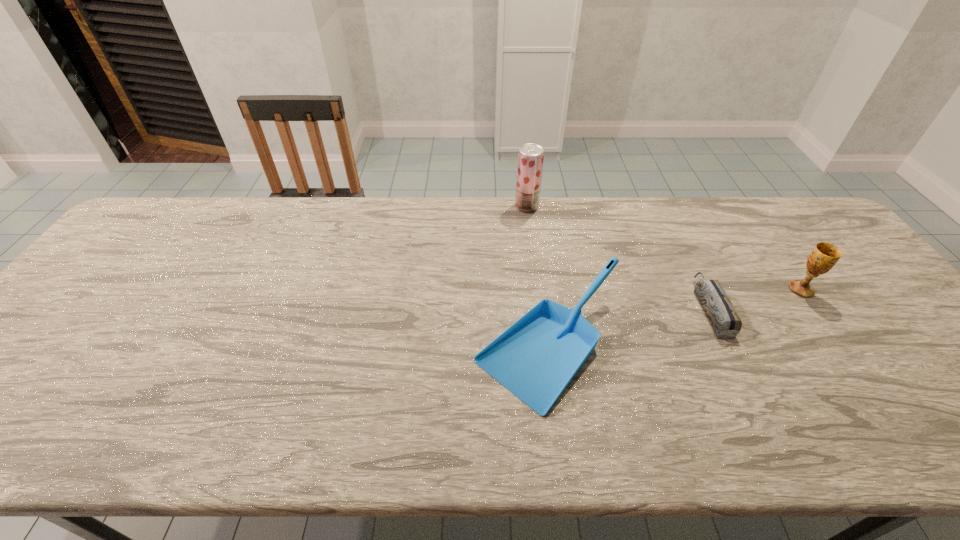
Where is `the tallest object`? Image resolution: width=960 pixels, height=540 pixels. the tallest object is located at coordinates (530, 156).

Locate an element on the screen. This screenshot has height=540, width=960. fruit juice is located at coordinates (530, 156).

Locate an element on the screen. The width and height of the screenshot is (960, 540). the rightmost object is located at coordinates (824, 256).

Identify the location of dustpan. (536, 358).

Find the location of `the third object from left to right`. the third object from left to right is located at coordinates (723, 317).

Where is `pencil box`? This screenshot has height=540, width=960. pencil box is located at coordinates (723, 317).

What are the coordinates of `free space located 0.340m on the right of the fruit juice` in the screenshot? It's located at (640, 206).

The height and width of the screenshot is (540, 960). Identify the location of vacant space situated on the front of the rightmost object. (894, 421).

Where is `free space located 0.120m on the left of the dustpan`? The height and width of the screenshot is (540, 960). free space located 0.120m on the left of the dustpan is located at coordinates (424, 345).

Find the location of a particular element. The image size is (960, 540). vacant area located on the right of the shortest object is located at coordinates (805, 308).